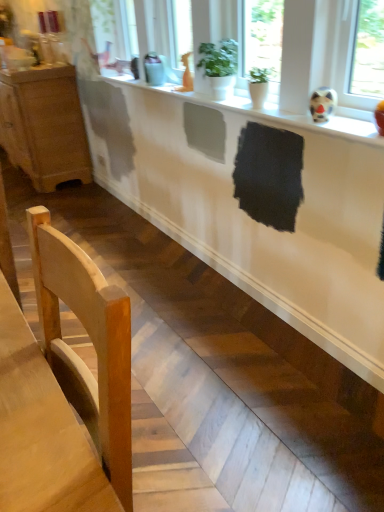
Locate an element on the screen. This screenshot has width=384, height=512. vacant space situated above white glossy counter at lower center (from a real-world perspective) is located at coordinates (190, 236).